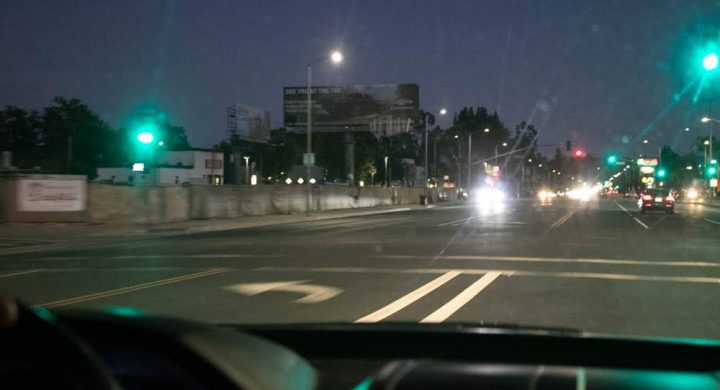
Image resolution: width=720 pixels, height=390 pixels. Identify the location of light. (337, 57).